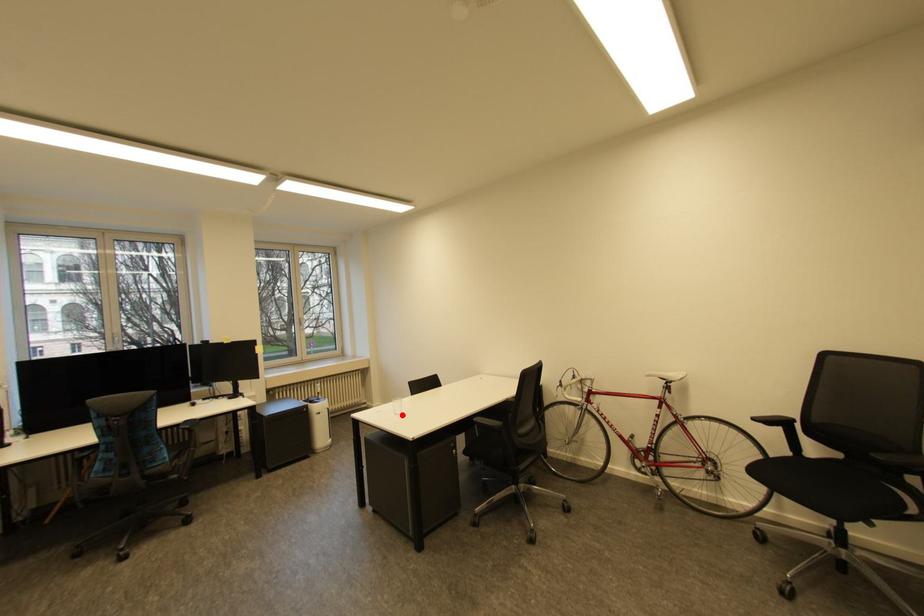
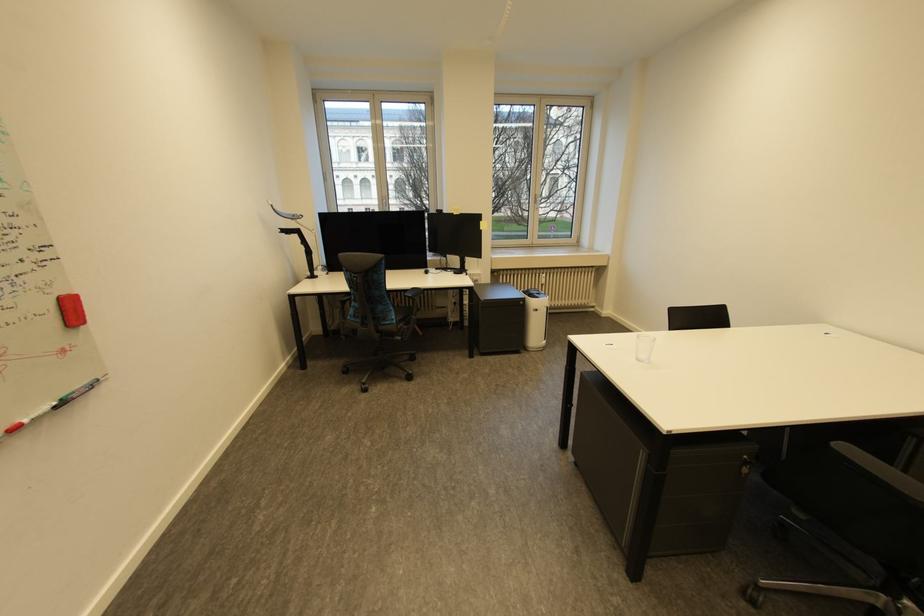
Where in the second image is the point corresponding to the highlighted location from the first image?

(646, 361)